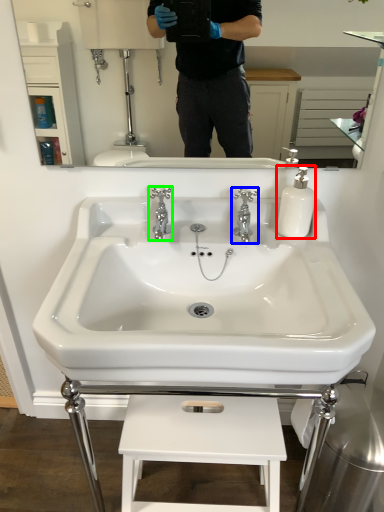
Question: Which is nearer to the soap dispenser (highlighted by a red box)? tap (highlighted by a blue box) or tap (highlighted by a green box).

Choices:
 (A) tap
 (B) tap

Answer: (A)